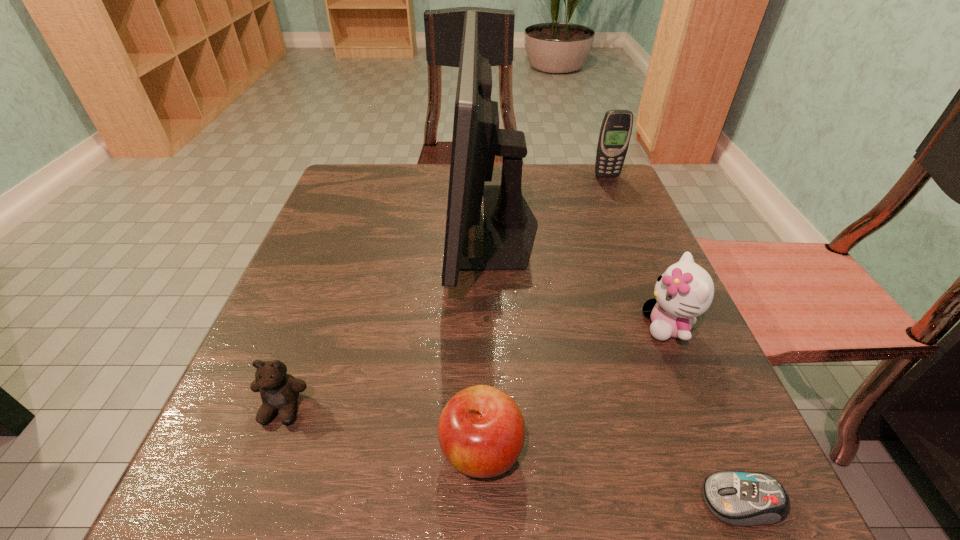
Where is `apple positioned at the near edge`? apple positioned at the near edge is located at coordinates (481, 432).

What are the coordinates of `computer mouse located at the near edge` in the screenshot? It's located at coord(741,498).

Identify the location of object present at the left edge. (279, 391).

Locate an element on the screen. Image resolution: width=960 pixels, height=540 pixels. cellular telephone at the right edge is located at coordinates (616, 128).

The width and height of the screenshot is (960, 540). Find the location of `kitten at the right edge`. kitten at the right edge is located at coordinates [685, 290].

This screenshot has width=960, height=540. Identify the location of computer mouse that is at the right edge. (741, 498).

The height and width of the screenshot is (540, 960). I want to click on object that is at the far right corner, so click(x=616, y=128).

Image resolution: width=960 pixels, height=540 pixels. What are the coordinates of `object that is at the near right corner` in the screenshot? It's located at click(741, 498).

Where is `blank space at the far edge of the desktop`? The image size is (960, 540). blank space at the far edge of the desktop is located at coordinates (402, 195).

The height and width of the screenshot is (540, 960). In the image, there is a desktop. In order to click on blank space at the near edge in this screenshot , I will do `click(596, 509)`.